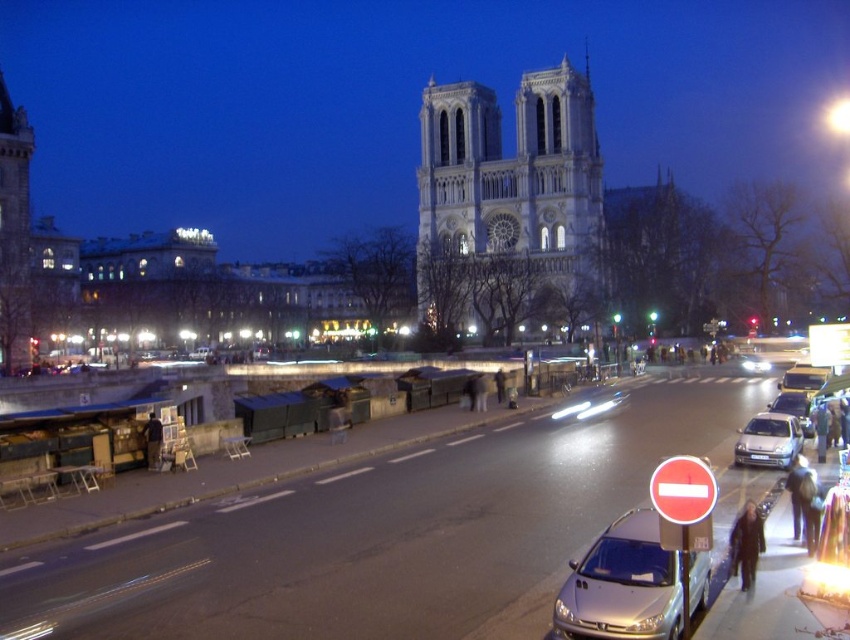
You are a tourist standing at the entrance of Notre Dame Cathedral and want to take a photo of the cathedral. There is a metallic silver car at lower center blocking your view. Where exactly is the metallic silver car located in relation to your position?

The metallic silver car at lower center is located at coordinates point (622, 586) relative to your position.

You are a pedestrian standing at the bottom left of the scene. You want to cross the street to reach the Notre Dame Cathedral. Which car, the satin silver car at lower right or the shiny silver car at center, is closer to you?

The satin silver car at lower right is closer to you because it is located below the shiny silver car at center, meaning it is nearer in the scene.

You are a delivery person needing to park your 1.5 meter tall delivery robot between the metallic silver car at lower center and the metallic silver sedan at center. Can your robot fit vertically between them?

The metallic silver car at lower center is taller than the metallic silver sedan at center. Since the robot is 1.5 meters tall, it can fit vertically between them as long as the space between the two vehicles allows, but the exact clearance depends on the height difference. However, since the car is taller, the minimum height between them would be determined by the sedan, so if the sedan is under 1.5 meters, it might not fit. Wait, the description says the car is taller than the sedan. So the sedan is lower